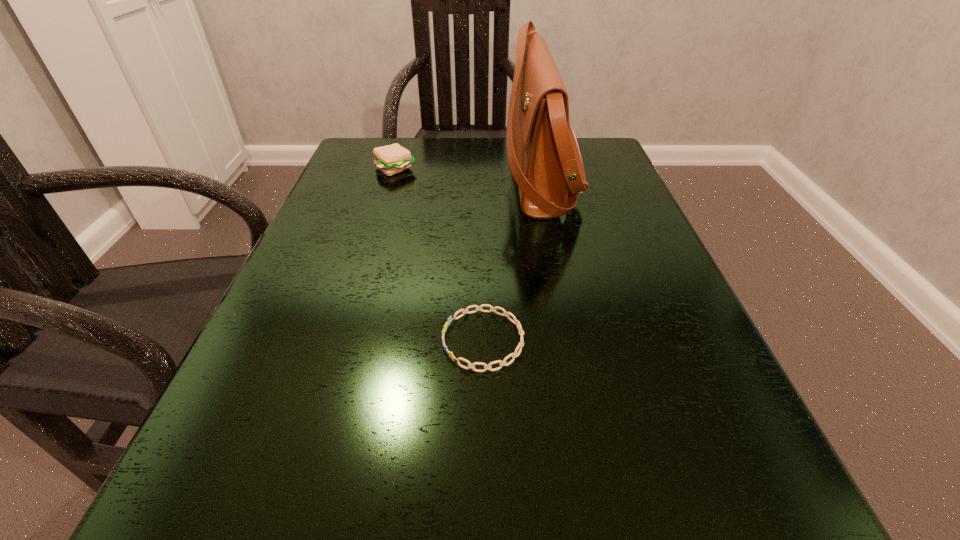
The image size is (960, 540). Find the location of `vacant space at the right edge of the desktop`. vacant space at the right edge of the desktop is located at coordinates (596, 198).

In the image, there is a desktop. Identify the location of vacant space at the far left corner. This screenshot has width=960, height=540. (346, 161).

Identify the location of free space at the near left corner of the desktop. The image size is (960, 540). (227, 538).

Where is `free space at the far right corner of the desktop`? The width and height of the screenshot is (960, 540). free space at the far right corner of the desktop is located at coordinates (589, 158).

You are a GUI agent. You are given a task and a screenshot of the screen. Output one action in this format:
    pyautogui.click(x=<x>, y=<y>)
    Task: Click on the vacant space that's between the patty and the nearest object
    The width and height of the screenshot is (960, 540).
    Given the screenshot: What is the action you would take?
    pyautogui.click(x=440, y=254)

Find the location of `vacant point located between the bracelet and the satchel`. vacant point located between the bracelet and the satchel is located at coordinates (512, 258).

I want to click on unoccupied position between the nearest object and the satchel, so click(x=512, y=258).

Find the location of a particular element. This screenshot has height=540, width=960. vacant area that lies between the nearest object and the tallest object is located at coordinates (512, 258).

Find the location of `free space between the tallest object and the second shortest object`. free space between the tallest object and the second shortest object is located at coordinates (468, 172).

This screenshot has width=960, height=540. Find the location of `free spot between the nearest object and the tallest object`. free spot between the nearest object and the tallest object is located at coordinates 512,258.